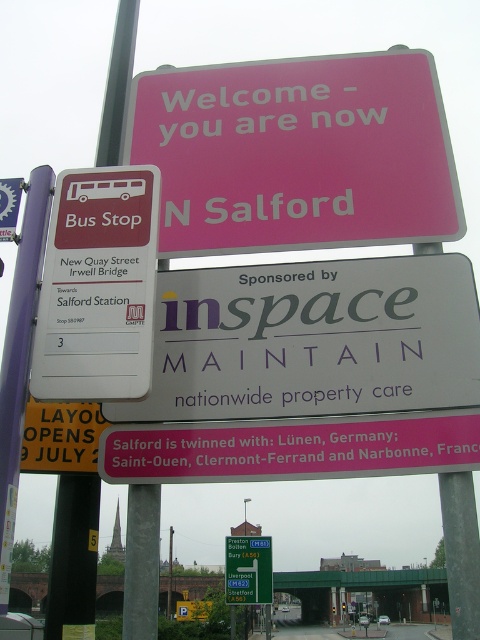
Who is shorter, metallic pole at left or green plastic bus stop sign at upper left?

With less height is metallic pole at left.

Between metallic pole at left and green plastic bus stop sign at upper left, which one appears on the right side from the viewer's perspective?

green plastic bus stop sign at upper left

The height and width of the screenshot is (640, 480). Identify the location of metallic pole at left. pos(72,556).

Is matte white bus stop sign at upper left thinner than metallic pole at left?

No.

Is point (107, 209) less distant than point (115, 42)?

Yes.

Identify the location of matte white bus stop sign at upper left. (97, 285).

Image resolution: width=480 pixels, height=640 pixels. Describe the element at coordinates (298, 154) in the screenshot. I see `pink plastic sign at upper center` at that location.

Can you confirm if pink plastic sign at upper center is positioned above metallic pole at left?

Indeed, pink plastic sign at upper center is positioned over metallic pole at left.

I want to click on pink plastic sign at upper center, so click(298, 154).

You are a GUI agent. You are given a task and a screenshot of the screen. Output one action in this format:
    pyautogui.click(x=<x>, y=<y>)
    Task: Click on the pink plastic sign at upper center
    Image resolution: width=480 pixels, height=640 pixels.
    Given the screenshot: What is the action you would take?
    pyautogui.click(x=298, y=154)